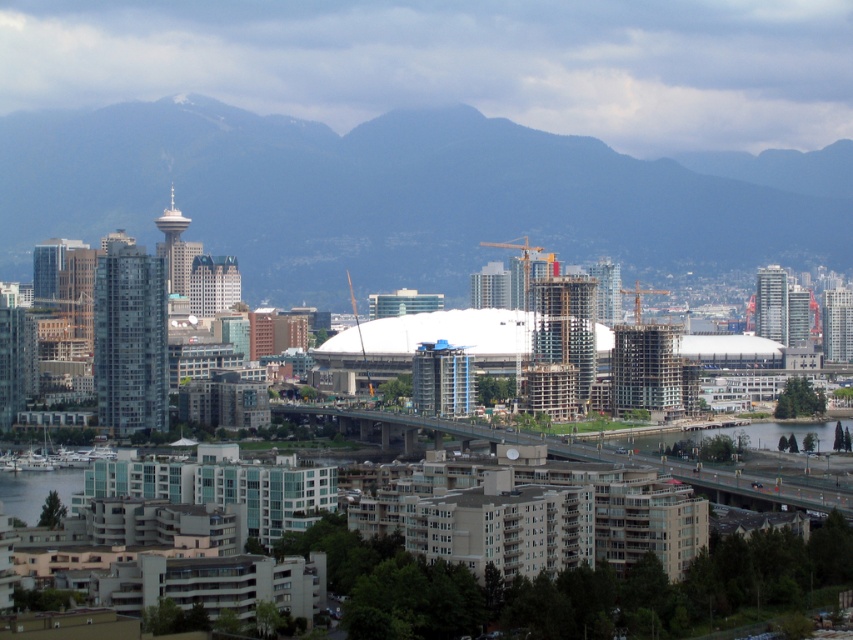
Question: Observing the image, what is the correct spatial positioning of blue-gray rock formation at upper center in reference to clear water at lower right?

Choices:
 (A) above
 (B) below

Answer: (A)

Question: Which is farther from the clear water at lower left?

Choices:
 (A) clear water at lower right
 (B) blue-gray rock formation at upper center

Answer: (A)

Question: Is blue-gray rock formation at upper center to the right of clear water at lower left from the viewer's perspective?

Choices:
 (A) no
 (B) yes

Answer: (B)

Question: Which is nearer to the clear water at lower left?

Choices:
 (A) blue-gray rock formation at upper center
 (B) clear water at lower right

Answer: (A)

Question: Estimate the real-world distances between objects in this image. Which object is farther from the clear water at lower left?

Choices:
 (A) blue-gray rock formation at upper center
 (B) clear water at lower right

Answer: (B)

Question: Is blue-gray rock formation at upper center wider than clear water at lower left?

Choices:
 (A) no
 (B) yes

Answer: (B)